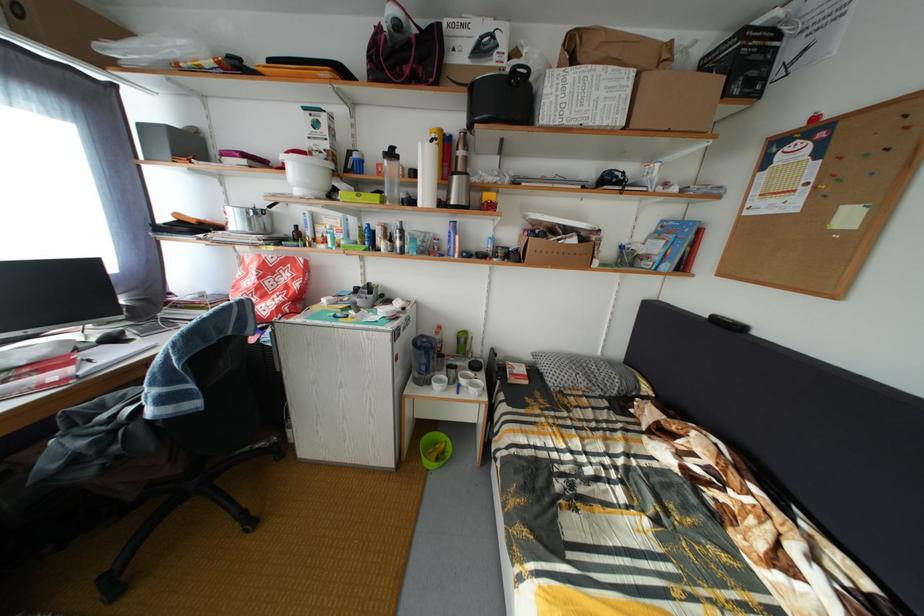
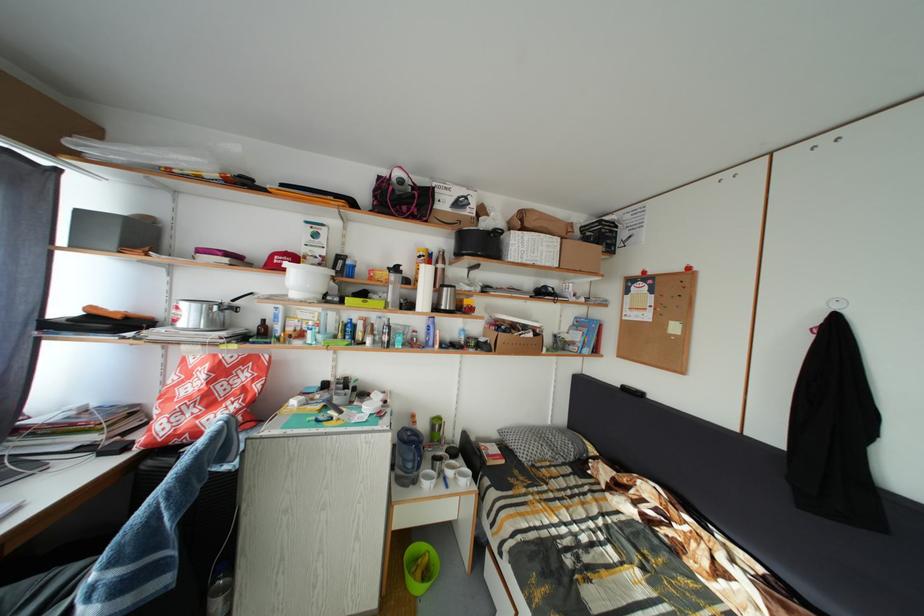
Question: The camera is either moving clockwise (left) or counter-clockwise (right) around the object. The first image is from the beginning of the video and the second image is from the end. Is the camera moving left or right when shooting the video?

Choices:
 (A) Left
 (B) Right

Answer: (A)